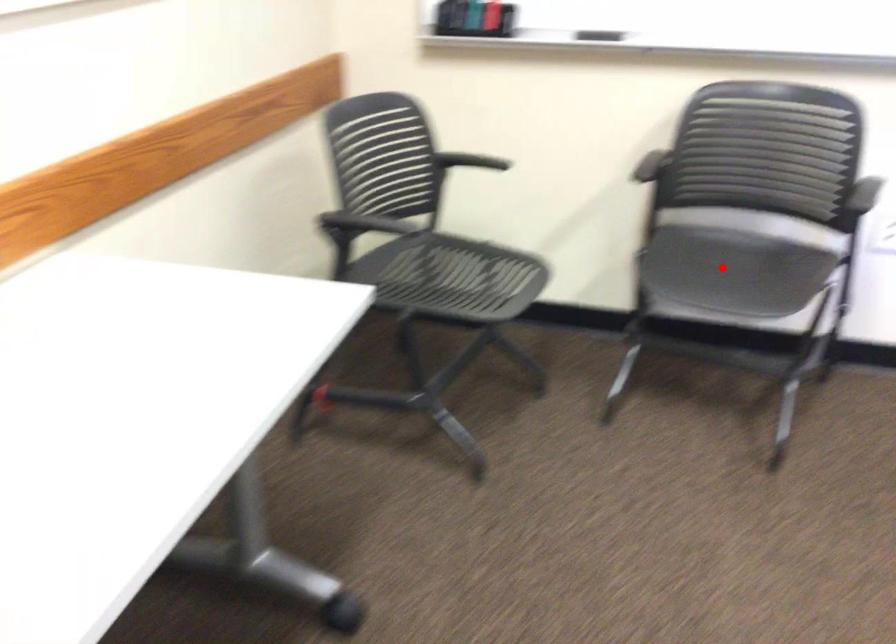
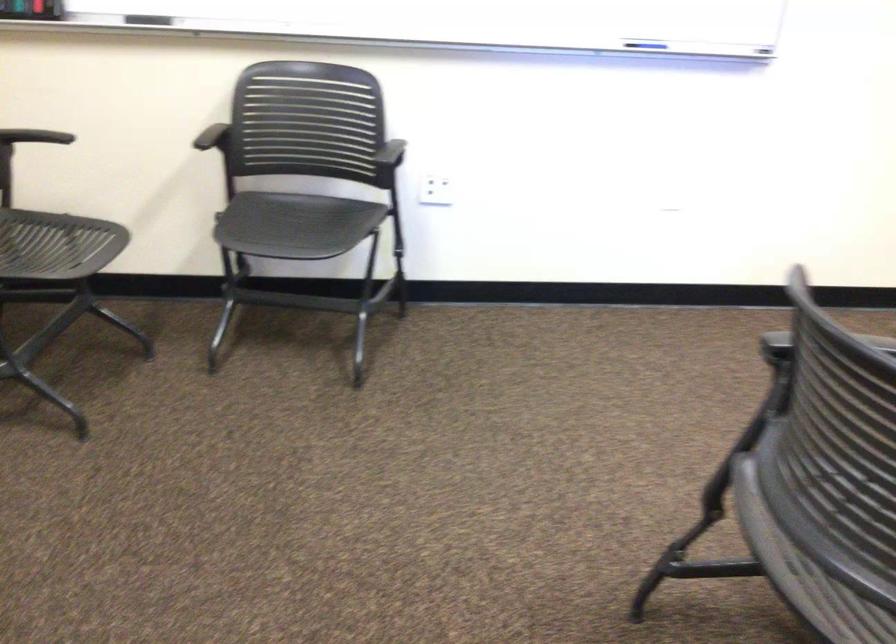
Question: I am providing you with two images of the same scene from different viewpoints. In image1, a red point is highlighted. Considering the same 3D point in image2, which of the following is correct?

Choices:
 (A) It is closer
 (B) It is farther

Answer: (B)